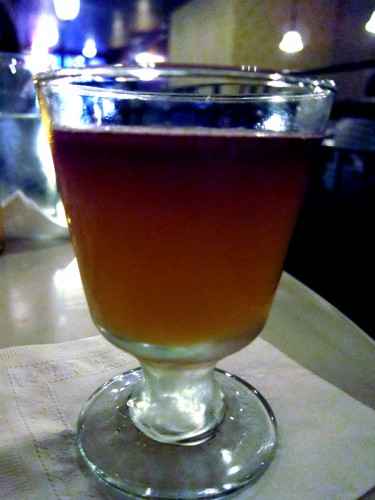
Identify the location of rim of glass. (308, 97).